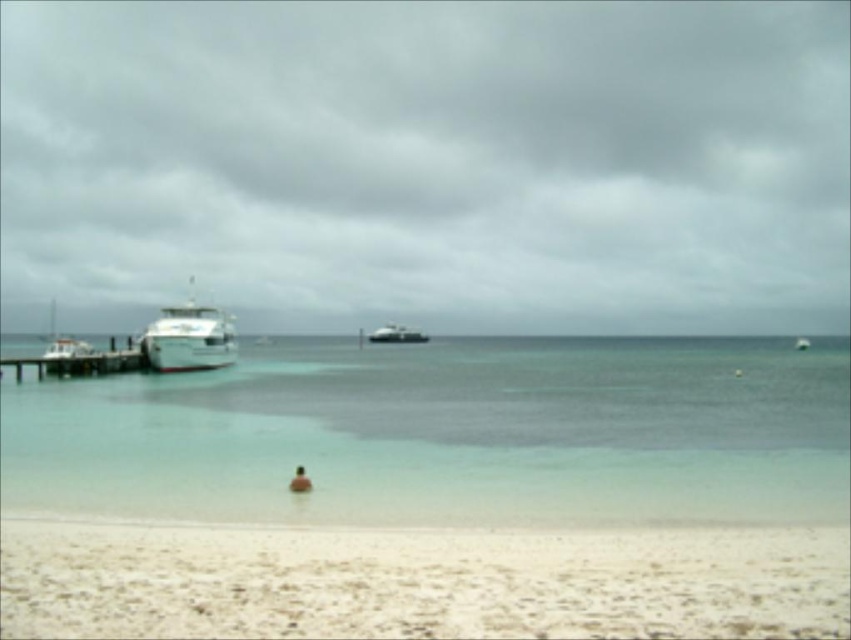
Between point (150, 358) and point (52, 360), which one is positioned in front?

Positioned in front is point (52, 360).

Is white glossy boat at left smaller than white wood dock at left?

No.

Where is `white glossy boat at left`? white glossy boat at left is located at coordinates (189, 337).

Between point (120, 352) and point (290, 484), which one is positioned behind?

Point (120, 352)

Identify the location of white wood dock at left. (80, 364).

Locate an element on the screen. white wood dock at left is located at coordinates (80, 364).

Does clear water at center appear on the right side of white glossy boat at left?

Indeed, clear water at center is positioned on the right side of white glossy boat at left.

Find the location of a particular element. clear water at center is located at coordinates (449, 433).